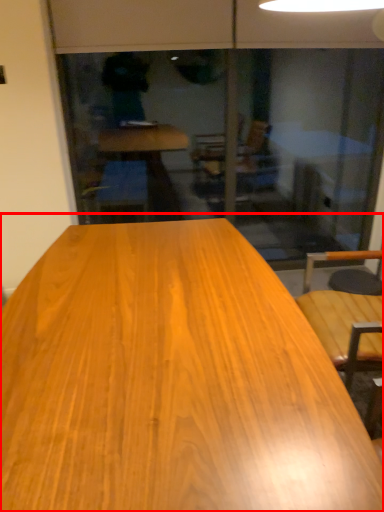
Question: Observing the image, what is the correct spatial positioning of table (annotated by the red box) in reference to screen door?

Choices:
 (A) left
 (B) right

Answer: (A)